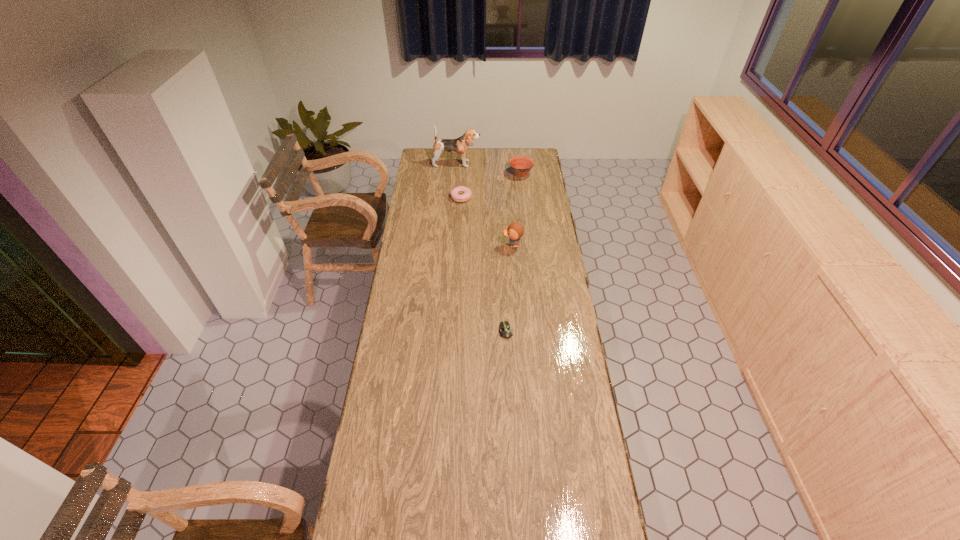
Where is `the tallest object`? the tallest object is located at coordinates (460, 145).

Locate an element on the screen. This screenshot has height=540, width=960. the second nearest object is located at coordinates (515, 231).

Identify the location of the fourth shortest object. (515, 231).

The image size is (960, 540). Identify the location of the third shortest object. (521, 165).

Locate an element on the screen. doughnut is located at coordinates (465, 192).

Image resolution: width=960 pixels, height=540 pixels. In order to click on the third nearest object in this screenshot , I will do `click(465, 192)`.

The image size is (960, 540). I want to click on computer mouse, so click(505, 331).

Where is `the shortest object`? The height and width of the screenshot is (540, 960). the shortest object is located at coordinates (505, 331).

Identify the location of vacant point located at the face of the puppy. The height and width of the screenshot is (540, 960). (543, 164).

Where is `free location located 0.400m on the front-facing side of the duck`? This screenshot has width=960, height=540. free location located 0.400m on the front-facing side of the duck is located at coordinates (420, 245).